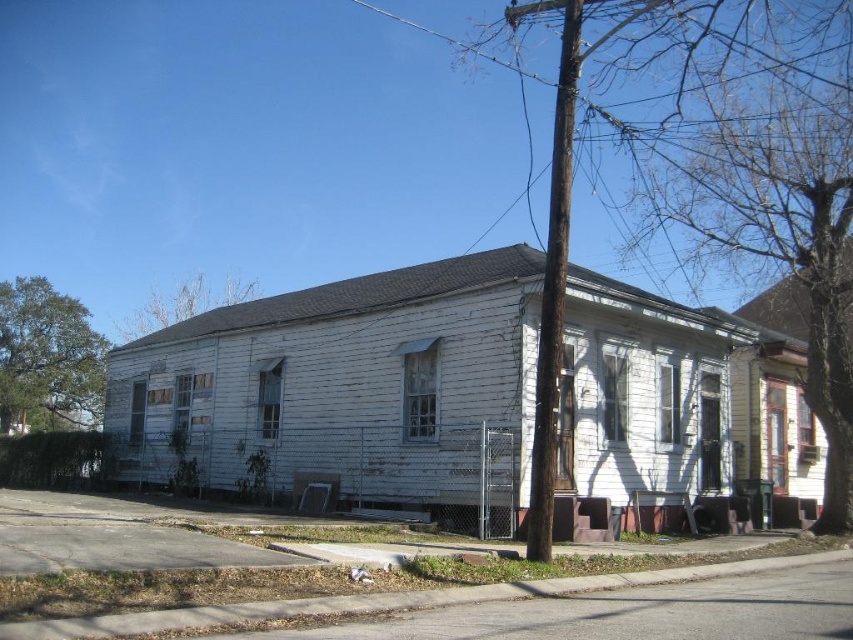
You are standing in front of the main building and notice two trees in the scene. Which tree, the green leafy tree at left or the brown leafy tree at upper left, is located more to the left side of the scene?

The green leafy tree at left is positioned on the left side of the brown leafy tree at upper left, so the green leafy tree at left is more to the left side of the scene.

You are a landscape architect planning to plant new trees in the area. Considering the sizes of the existing bare wood tree at upper right and green leafy tree at left, which one would require more space for its root system?

The bare wood tree at upper right has a larger size compared to the green leafy tree at left, so it would require more space for its root system.

You are a landscape architect assessing this property. You notice the bare wood tree at upper right and the brown leafy tree at upper left. Which tree would cast a larger shadow in the afternoon sun?

The bare wood tree at upper right is bigger than the brown leafy tree at upper left, so it would cast a larger shadow in the afternoon sun.